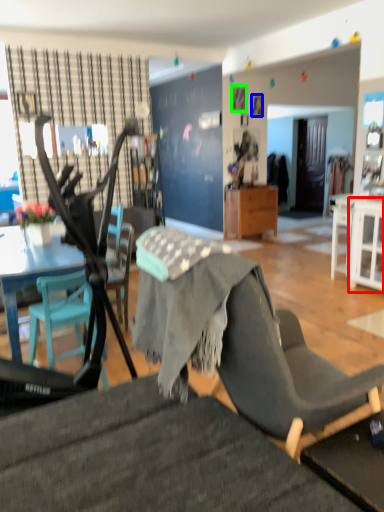
Question: Which is farther away from cabinetry (highlighted by a red box)? picture frame (highlighted by a blue box) or picture frame (highlighted by a green box)?

Choices:
 (A) picture frame
 (B) picture frame

Answer: (B)